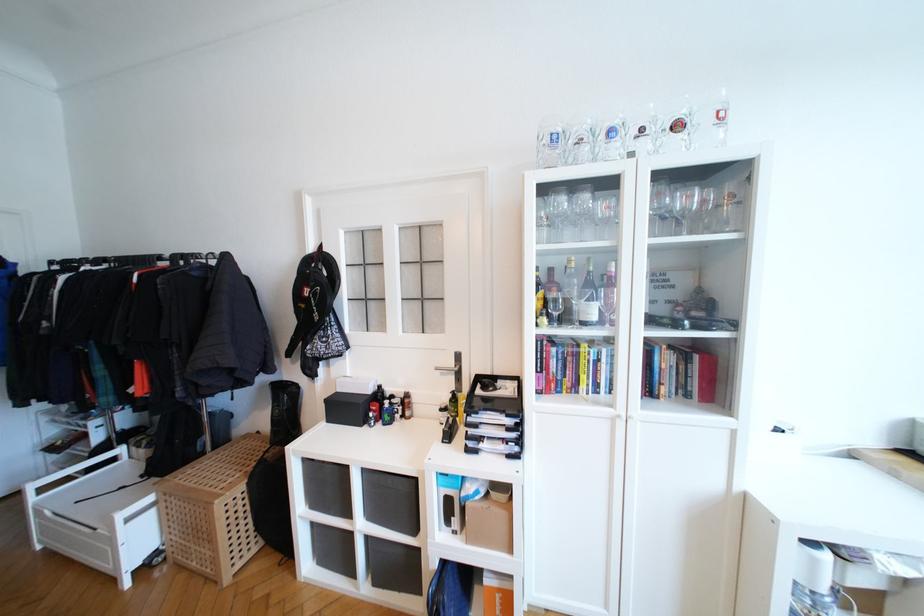
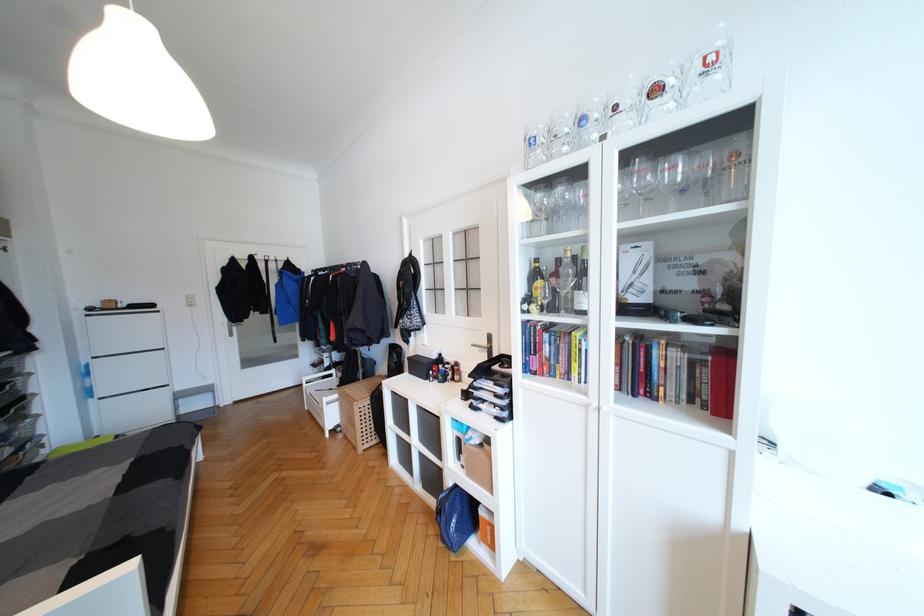
Locate, in the second image, the point that corresponds to the point at 371,540 in the first image.

(423, 456)